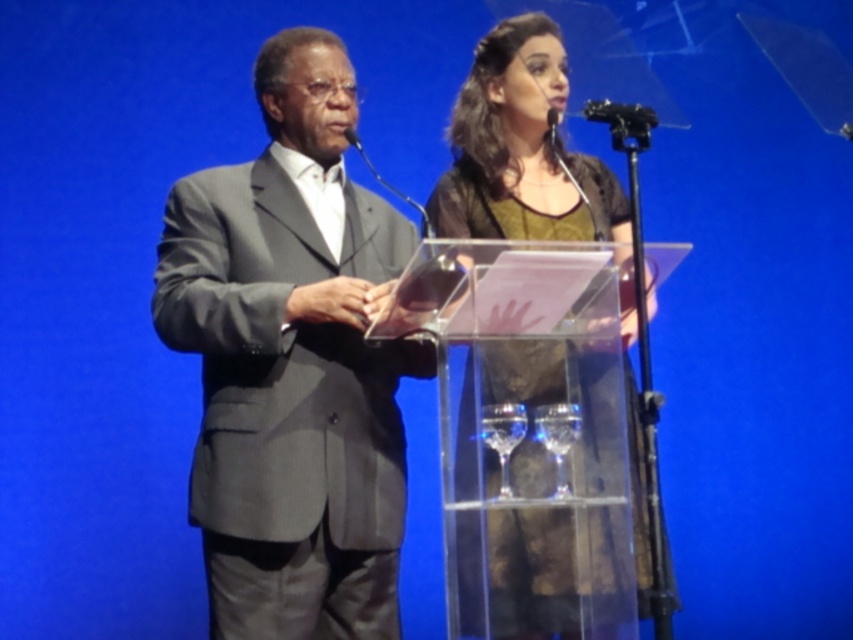
Question: Which point is farther from the camera taking this photo?

Choices:
 (A) (354, 141)
 (B) (347, 349)
 (C) (555, 24)

Answer: (C)

Question: Is matte brown dress at center closer to the viewer compared to black plastic microphone at upper center?

Choices:
 (A) no
 (B) yes

Answer: (B)

Question: Which object is the farthest from the gray suit at left?

Choices:
 (A) black plastic microphone at upper center
 (B) matte brown dress at center

Answer: (A)

Question: Is gray suit at left further to camera compared to matte brown dress at center?

Choices:
 (A) yes
 (B) no

Answer: (B)

Question: Considering the relative positions of matte brown dress at center and black plastic microphone at upper center in the image provided, where is matte brown dress at center located with respect to black plastic microphone at upper center?

Choices:
 (A) below
 (B) above

Answer: (A)

Question: Which object is closer to the camera taking this photo?

Choices:
 (A) gray suit at left
 (B) black plastic microphone at upper center
 (C) matte brown dress at center

Answer: (A)